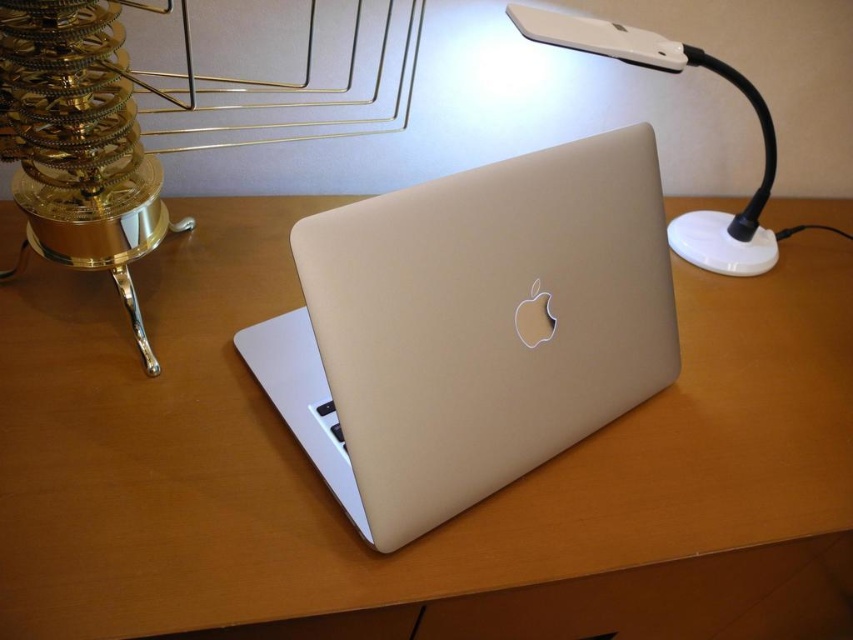
Question: Which point appears farthest from the camera in this image?

Choices:
 (A) (607, 38)
 (B) (514, 506)
 (C) (416, 332)

Answer: (A)

Question: Which object is positioned closest to the wooden table at center?

Choices:
 (A) satin gold laptop at center
 (B) white plastic lamp at upper right

Answer: (A)

Question: Estimate the real-world distances between objects in this image. Which object is closer to the wooden table at center?

Choices:
 (A) satin gold laptop at center
 (B) white plastic lamp at upper right

Answer: (A)

Question: Considering the relative positions of satin gold laptop at center and white plastic lamp at upper right in the image provided, where is satin gold laptop at center located with respect to white plastic lamp at upper right?

Choices:
 (A) right
 (B) left

Answer: (B)

Question: Is wooden table at center positioned before white plastic lamp at upper right?

Choices:
 (A) yes
 (B) no

Answer: (A)

Question: Where is satin gold laptop at center located in relation to white plastic lamp at upper right in the image?

Choices:
 (A) below
 (B) above

Answer: (A)